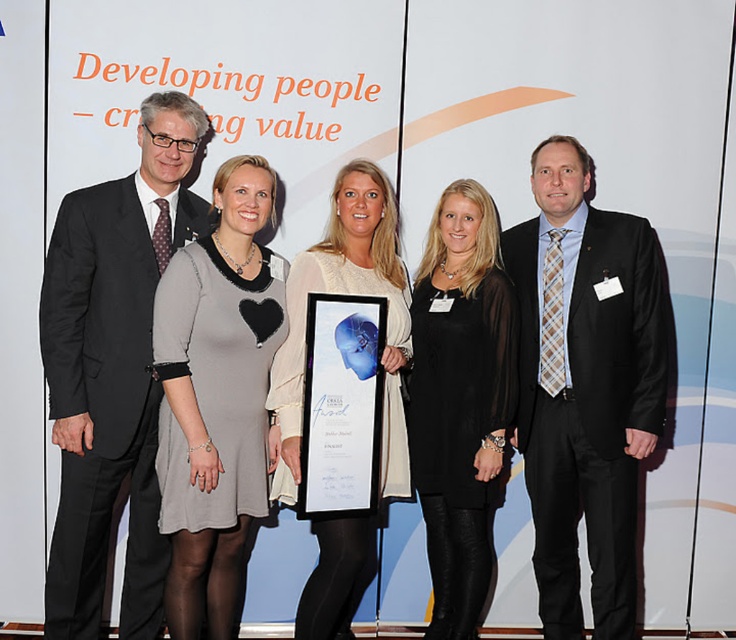
Question: Can you confirm if black leather dress at center is smaller than blue glossy certificate at center?

Choices:
 (A) yes
 (B) no

Answer: (B)

Question: Which point is farther from the camera taking this photo?

Choices:
 (A) (300, 396)
 (B) (629, 348)
 (C) (369, 385)
 (D) (159, 604)

Answer: (D)

Question: Can you confirm if gray matte dress at center is wider than white lace dress at center?

Choices:
 (A) no
 (B) yes

Answer: (A)

Question: Which object is the farthest from the black leather dress at center?

Choices:
 (A) white lace dress at center
 (B) gray matte dress at center

Answer: (B)

Question: Among these points, which one is nearest to the camera?

Choices:
 (A) (453, 600)
 (B) (539, 408)

Answer: (B)

Question: Does matte black suit at right appear over black leather dress at center?

Choices:
 (A) no
 (B) yes

Answer: (B)